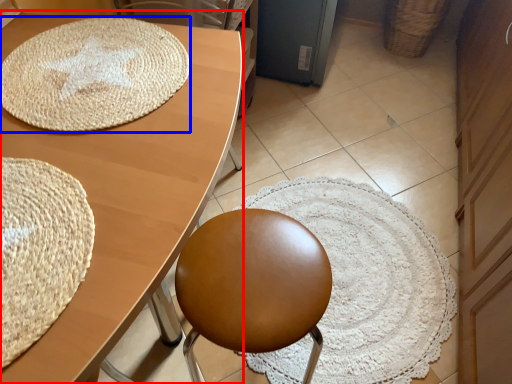
Question: Which point is further to the camera, table (highlighted by a red box) or mat (highlighted by a blue box)?

Choices:
 (A) table
 (B) mat

Answer: (B)